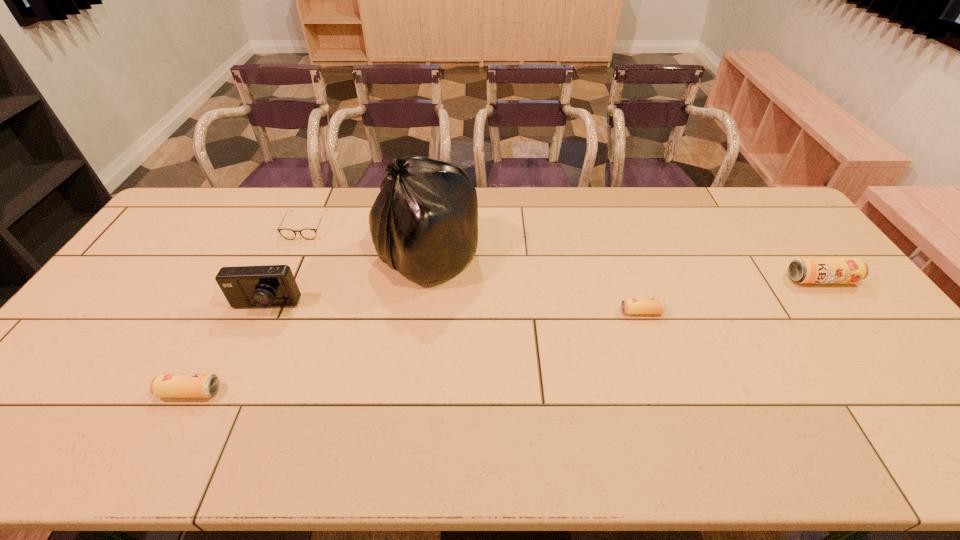
Please determine a free point for an extra beer_can to ensure balance. Please provide its 2D coordinates. Your answer should be formatted as a tuple, i.e. [(x, y)], where the tuple contains the x and y coordinates of a point satisfying the conditions above.

[(433, 348)]